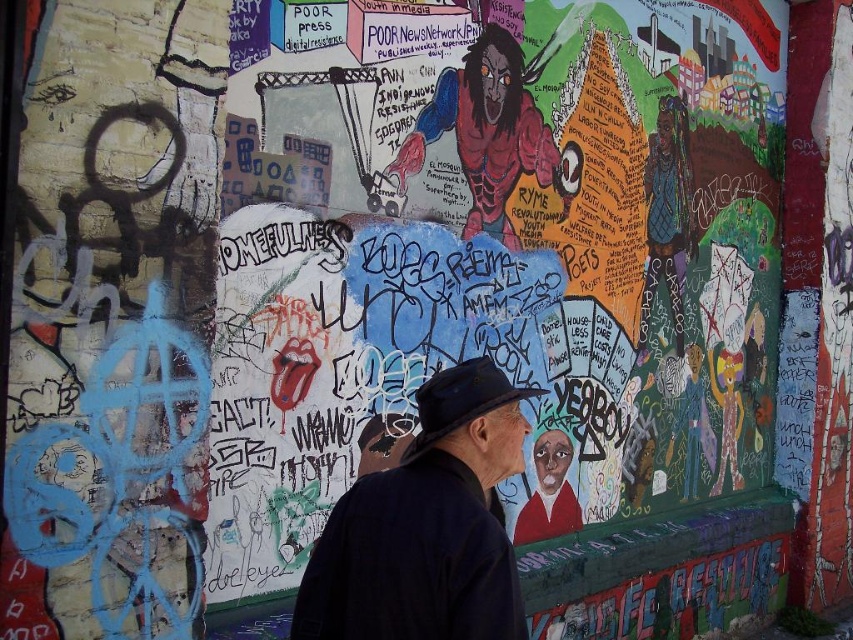
Is dark blue fabric jacket at center thinner than black felt hat at center?

No, dark blue fabric jacket at center is not thinner than black felt hat at center.

Does dark blue fabric jacket at center appear over black felt hat at center?

No.

Which is behind, point (451, 515) or point (494, 387)?

Point (494, 387)

Identify the location of dark blue fabric jacket at center. (426, 525).

Does dark blue fabric jacket at center appear under dark blue hat at center?

No.

Is point (444, 449) less distant than point (384, 416)?

Yes, it is in front of point (384, 416).

Where is `dark blue fabric jacket at center`? dark blue fabric jacket at center is located at coordinates (426, 525).

Locate an element on the screen. The width and height of the screenshot is (853, 640). black felt hat at center is located at coordinates (460, 401).

This screenshot has height=640, width=853. Identify the location of black felt hat at center. (460, 401).